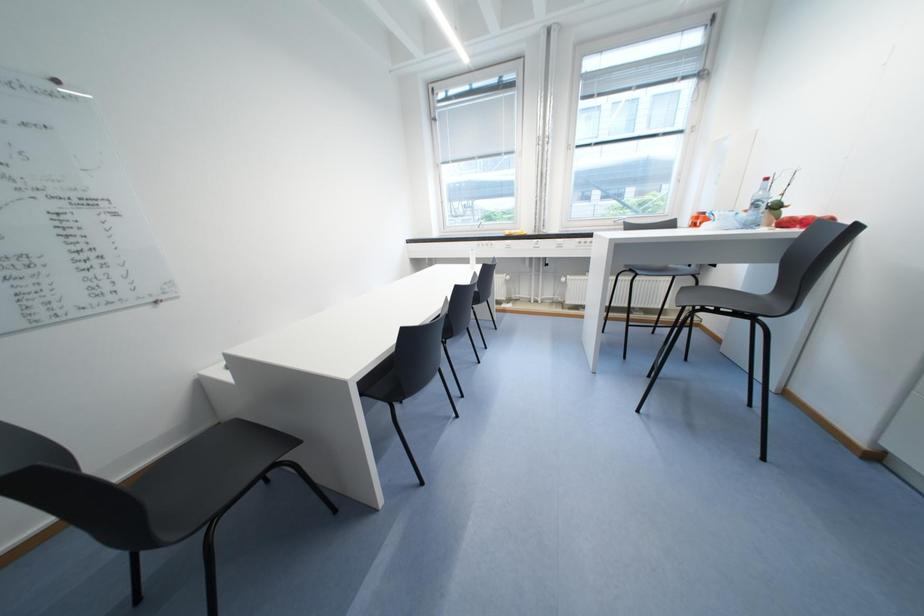
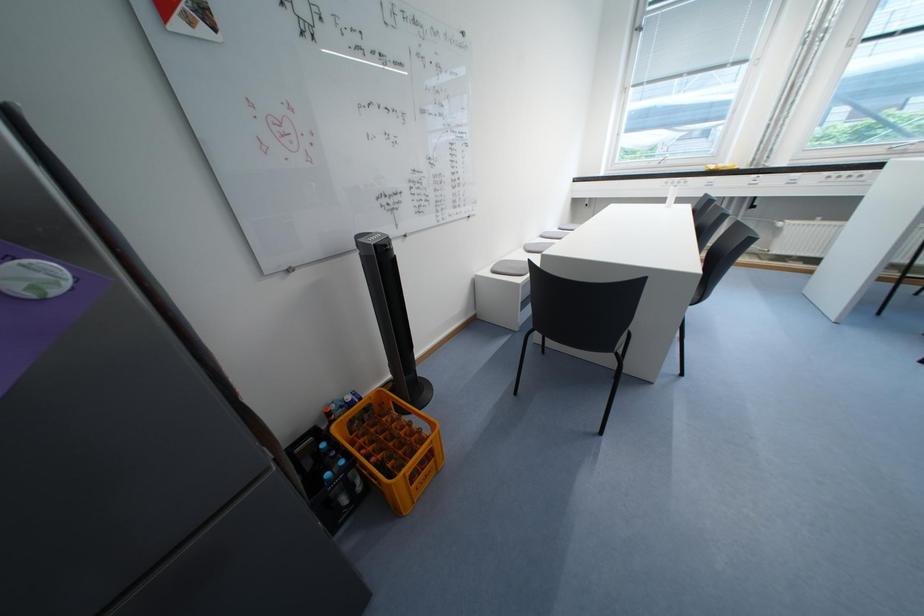
The images are taken continuously from a first-person perspective. In which direction are you moving?

The cameraman moved toward left, backward.